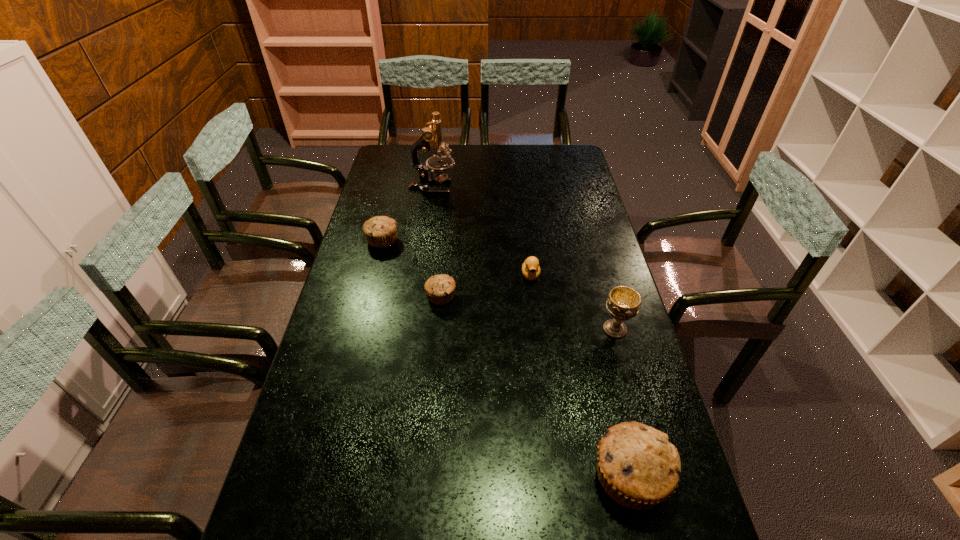
Identify the location of free space between the nearest object and the microscope. (531, 332).

At what (x,y) coordinates should I click in order to perform the action: click on free space between the tallest muffin and the third nearest object. Please return your answer as a coordinate pair (x, y). Looking at the image, I should click on (535, 387).

Where is `vacant area between the chalice and the microscope`? vacant area between the chalice and the microscope is located at coordinates (524, 258).

You are a GUI agent. You are given a task and a screenshot of the screen. Output one action in this format:
    pyautogui.click(x=<x>, y=<y>)
    Task: Click on the free space that is in between the third shortest object and the duckling
    This screenshot has width=960, height=540.
    Given the screenshot: What is the action you would take?
    pyautogui.click(x=456, y=258)

Image resolution: width=960 pixels, height=540 pixels. I want to click on free space between the duckling and the nearest object, so click(580, 376).

Find the location of `empty space between the farthest object and the rightmost muffin`. empty space between the farthest object and the rightmost muffin is located at coordinates (531, 332).

Where is `vacant space that's between the chalice and the nearest muffin`? The height and width of the screenshot is (540, 960). vacant space that's between the chalice and the nearest muffin is located at coordinates (622, 403).

Image resolution: width=960 pixels, height=540 pixels. I want to click on vacant area between the microscope and the fifth farthest object, so click(524, 258).

Locate which object ranks third in proximity to the second farthest object. Please provide its 2D coordinates. Your answer should be formatted as a tuple, i.e. [(x, y)], where the tuple contains the x and y coordinates of a point satisfying the conditions above.

[(531, 270)]

Identify which object is the second closest to the chalice. Please provide its 2D coordinates. Your answer should be formatted as a tuple, i.e. [(x, y)], where the tuple contains the x and y coordinates of a point satisfying the conditions above.

[(638, 467)]